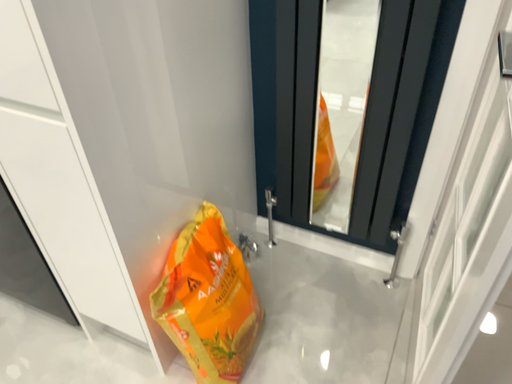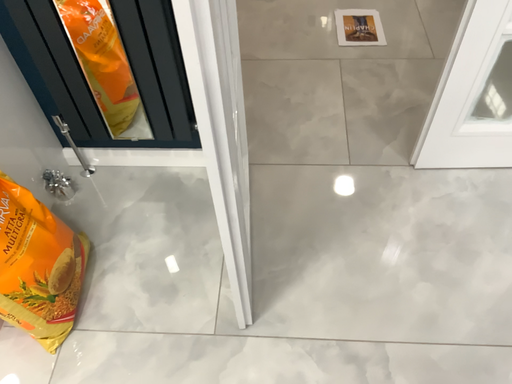
Question: Which way did the camera rotate in the video?

Choices:
 (A) rotated downward
 (B) rotated upward

Answer: (A)